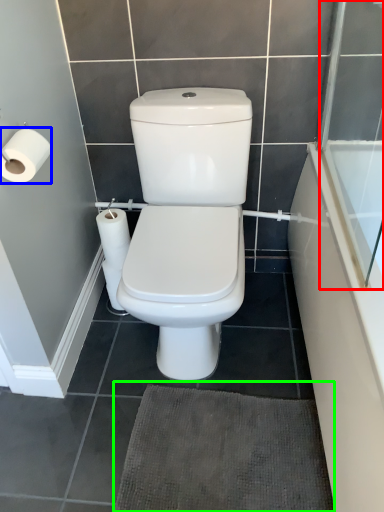
Question: Based on their relative distances, which object is farther from screen door (highlighted by a red box)? Choose from toilet paper (highlighted by a blue box) and bath mat (highlighted by a green box).

Choices:
 (A) toilet paper
 (B) bath mat

Answer: (A)